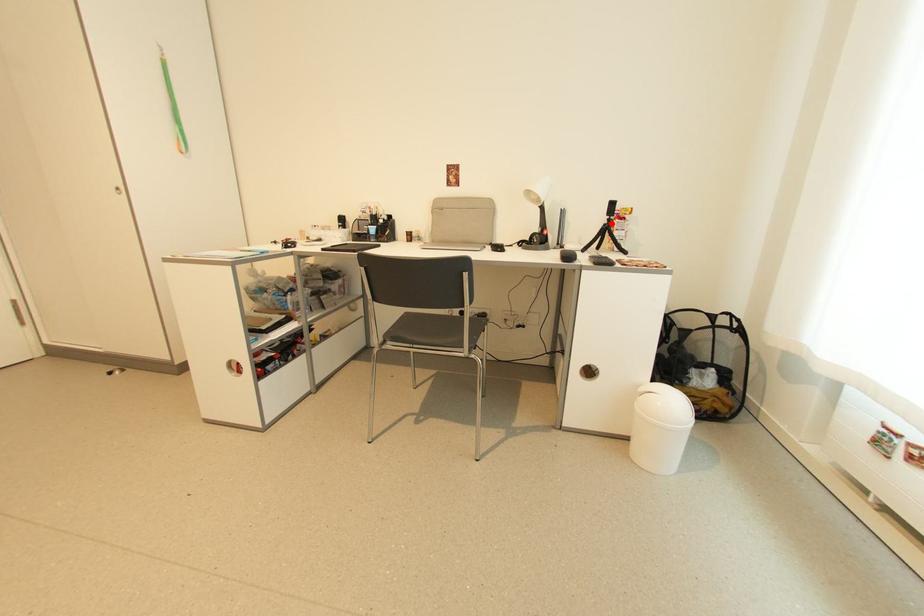
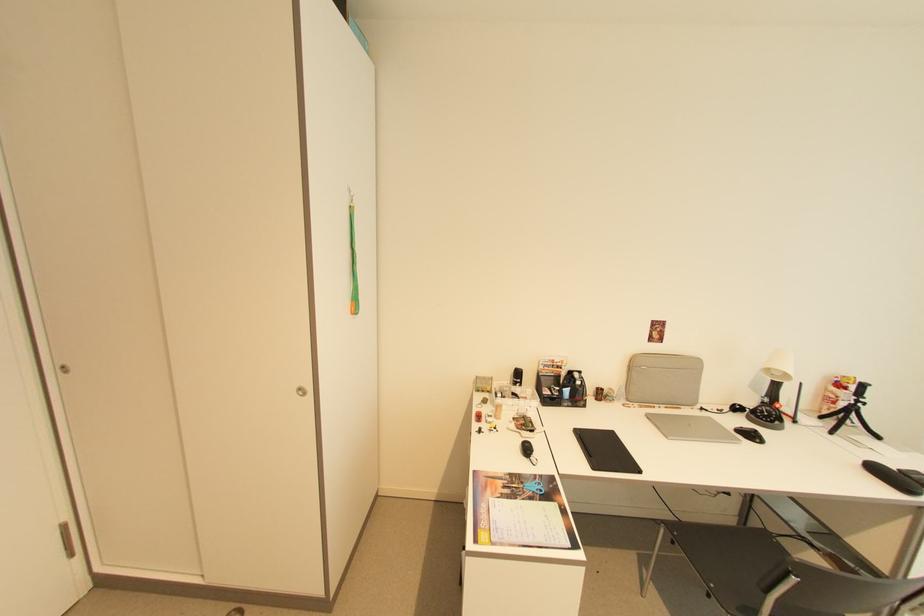
Question: I am providing you with two images of the same scene from different viewpoints. Image1 has a red point marked. In image2, the corresponding 3D location appears at what relative position? Reply with the corresponding letter.

Choices:
 (A) Closer
 (B) Farther

Answer: (A)